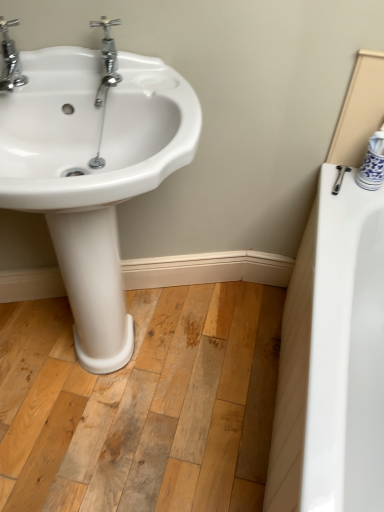
Find the location of a particular element. The width and height of the screenshot is (384, 512). unoccupied region to the right of white glossy sink at left is located at coordinates (231, 357).